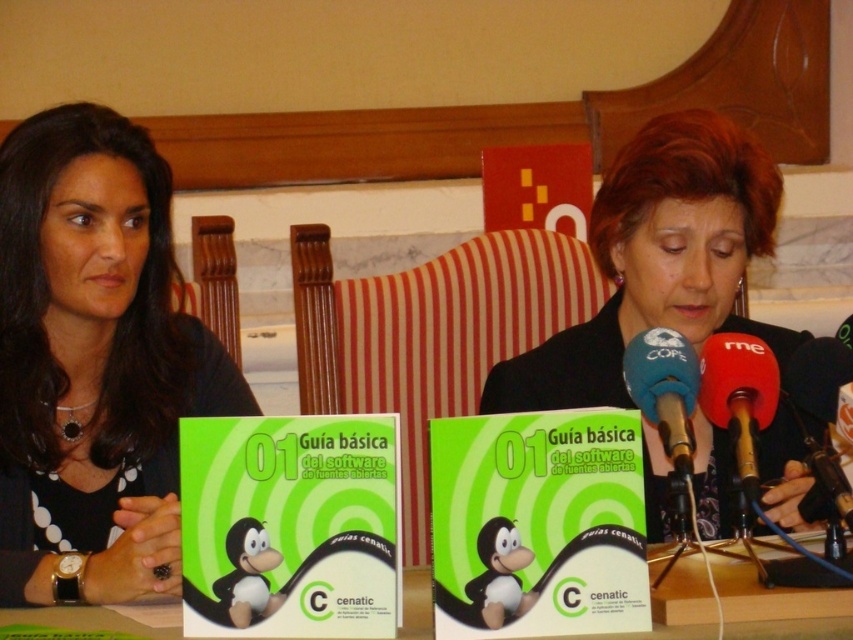
Question: Where is black fabric jacket at center located in relation to blue fabric microphone at center in the image?

Choices:
 (A) left
 (B) right

Answer: (B)

Question: Which point is farther to the camera?

Choices:
 (A) matte black shirt at left
 (B) blue fabric microphone at center
 (C) green paper at center
 (D) black fabric jacket at center

Answer: (A)

Question: Which point appears farthest from the camera in this image?

Choices:
 (A) (39, 257)
 (B) (700, 326)
 (C) (641, 387)
 (D) (786, 628)

Answer: (B)

Question: Considering the relative positions of matte black shirt at left and blue fabric microphone at center in the image provided, where is matte black shirt at left located with respect to blue fabric microphone at center?

Choices:
 (A) left
 (B) right

Answer: (A)

Question: Which of the following is the closest to the observer?

Choices:
 (A) (782, 474)
 (B) (119, 627)

Answer: (B)

Question: Is black fabric jacket at center to the right of blue fabric microphone at center from the viewer's perspective?

Choices:
 (A) yes
 (B) no

Answer: (A)